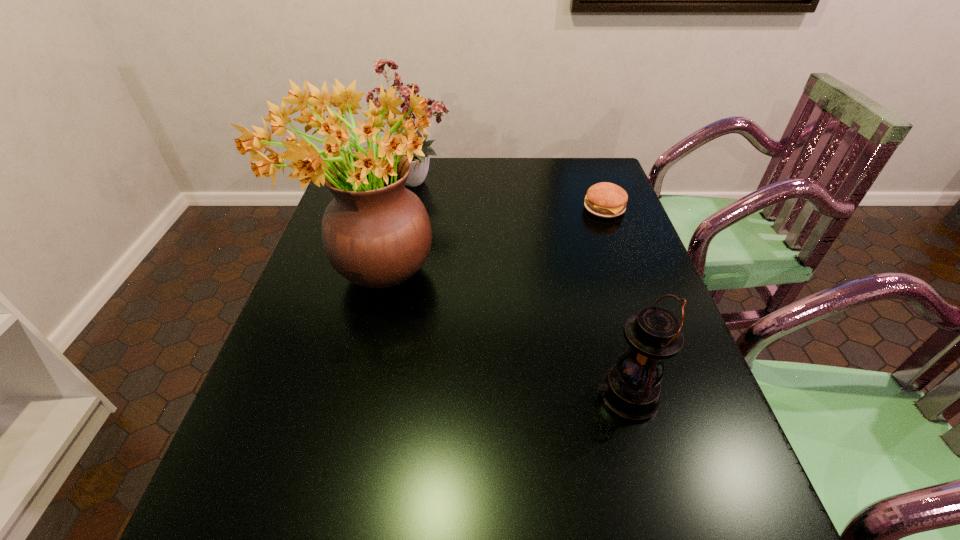
Point to a free spot located above the third tallest object, indicating its light source. Please provide its 2D coordinates. Your answer should be formatted as a tuple, i.e. [(x, y)], where the tuple contains the x and y coordinates of a point satisfying the conditions above.

[(487, 396)]

Identify a few places in vacant region located above the third tallest object, indicating its light source. Please provide its 2D coordinates. Your answer should be formatted as a tuple, i.e. [(x, y)], where the tuple contains the x and y coordinates of a point satisfying the conditions above.

[(428, 396)]

You are a GUI agent. You are given a task and a screenshot of the screen. Output one action in this format:
    pyautogui.click(x=<x>, y=<y>)
    Task: Click on the vacant region located 0.110m on the back of the second farthest object
    The width and height of the screenshot is (960, 540).
    Given the screenshot: What is the action you would take?
    pyautogui.click(x=593, y=180)

I want to click on object located in the far edge section of the desktop, so click(438, 108).

You are a GUI agent. You are given a task and a screenshot of the screen. Output one action in this format:
    pyautogui.click(x=<x>, y=<y>)
    Task: Click on the lantern that is positioned at the right edge
    This screenshot has height=540, width=960.
    Given the screenshot: What is the action you would take?
    pyautogui.click(x=631, y=389)

In order to click on hamburger present at the right edge in this screenshot , I will do `click(607, 200)`.

Image resolution: width=960 pixels, height=540 pixels. In order to click on object located in the far left corner section of the desktop in this screenshot , I will do `click(438, 108)`.

Locate an element on the screen. The image size is (960, 540). vacant space at the far edge of the desktop is located at coordinates (461, 173).

What are the coordinates of `free space at the left edge of the desktop` in the screenshot? It's located at (274, 395).

What are the coordinates of `free space at the right edge of the desktop` in the screenshot? It's located at (605, 232).